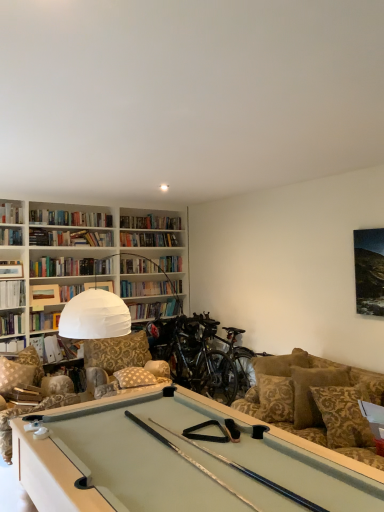
Question: From a real-world perspective, relative to hardcover book at upper left, the fourth book positioned from the bottom, is patterned fabric pillow at center, the 3th pillow viewed from the right, vertically above or below?

Choices:
 (A) above
 (B) below

Answer: (B)

Question: Based on their positions, is patterned fabric pillow at center, the first pillow when ordered from left to right, located to the left or right of hardcover book at upper left, the second book viewed from the top?

Choices:
 (A) left
 (B) right

Answer: (B)

Question: Which object is the farthest from the shiny black mountain bike at center, positioned as the second mountain bike in right-to-left order?

Choices:
 (A) camouflage fabric swivel chair at lower left
 (B) hardcover book at left, placed as the 3th book when sorted from top to bottom
 (C) silver metallic mountain bike at center, which appears as the 1th mountain bike when viewed from the right
 (D) brown damask pillow at right, which appears as the first pillow when viewed from the right
 (E) brown textured pillow at right, the 2th pillow when ordered from back to front

Answer: (B)

Question: Which of these objects is positioned farthest from the shiny black mountain bike at center, placed as the first mountain bike when sorted from left to right?

Choices:
 (A) hardcover book at left, acting as the first book starting from the top
 (B) matte white book at upper left, placed as the fourth book when sorted from top to bottom
 (C) hardcover book at left, the fifth book positioned from the top
 (D) silver metallic mountain bike at center, the second mountain bike viewed from the left
 (E) camouflage fabric swivel chair at lower left

Answer: (A)